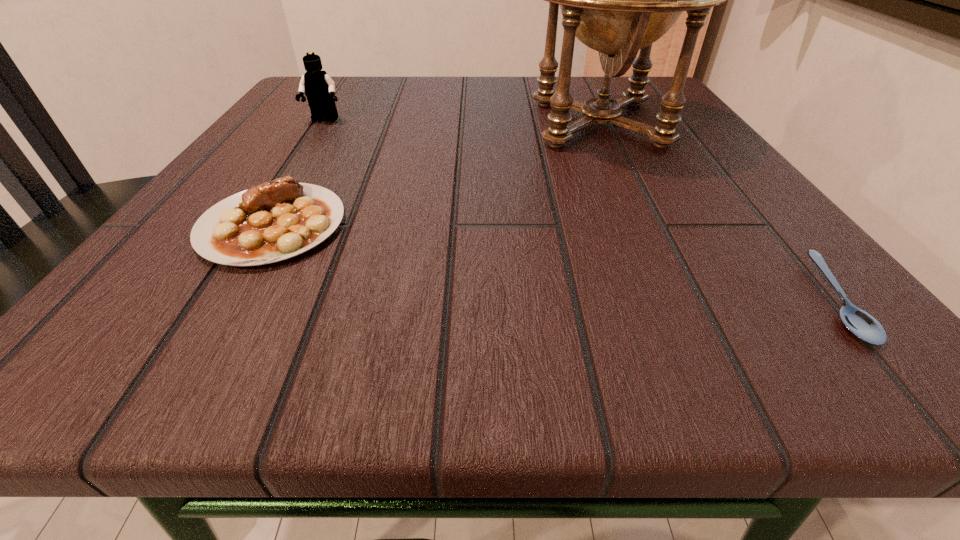
Where is `vacant region at the far edge`? The height and width of the screenshot is (540, 960). vacant region at the far edge is located at coordinates (503, 85).

You are a GUI agent. You are given a task and a screenshot of the screen. Output one action in this format:
    pyautogui.click(x=<x>, y=<y>)
    Task: Click on the free space at the left edge of the desktop
    
    Given the screenshot: What is the action you would take?
    pos(210,190)

Locate an element on the screen. This screenshot has height=540, width=960. vacant space at the right edge of the desktop is located at coordinates (684, 271).

In the image, there is a desktop. Where is `vacant space at the far left corner`? vacant space at the far left corner is located at coordinates (291, 104).

I want to click on free space at the near right corner of the desktop, so click(x=846, y=355).

I want to click on free space between the Lego and the soupspoon, so click(579, 210).

The width and height of the screenshot is (960, 540). Identify the location of empty space that is in between the steak and the Lego. pyautogui.click(x=299, y=173).

Identify the location of free point between the second shortest object and the shortest object. This screenshot has width=960, height=540. (553, 262).

Locate an element on the screen. This screenshot has height=540, width=960. vacant area that lies between the steak and the globe is located at coordinates tap(436, 174).

Locate an element on the screen. free space between the second tallest object and the globe is located at coordinates (462, 122).